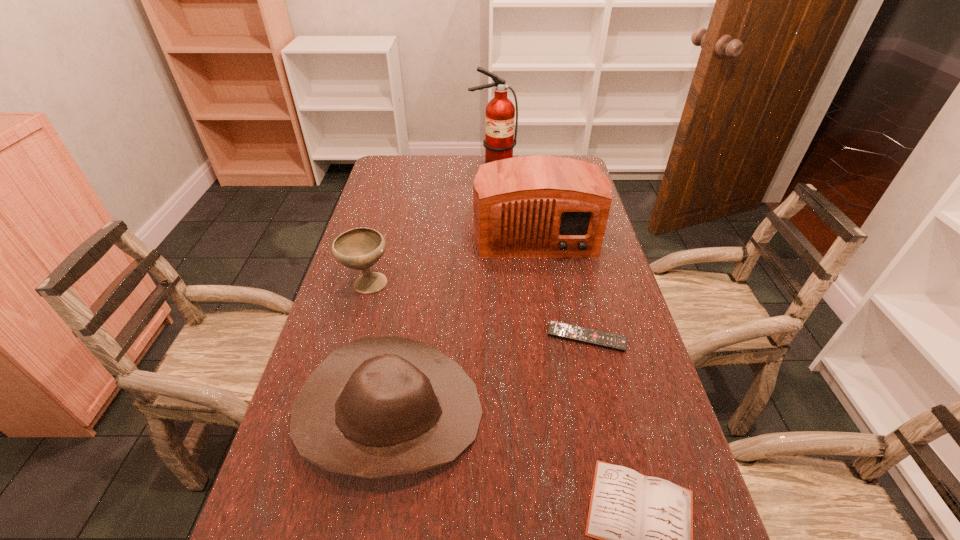
The width and height of the screenshot is (960, 540). I want to click on vacant space located 0.310m on the right of the cowboy hat, so (627, 413).

At what (x,y) coordinates should I click in order to perform the action: click on free spot located 0.060m on the front of the shortest object. Please return your answer as a coordinate pair (x, y). The image size is (960, 540). Looking at the image, I should click on (595, 374).

At what (x,y) coordinates should I click in order to perform the action: click on object that is positioned at the far edge. Please return your answer as a coordinate pair (x, y). The width and height of the screenshot is (960, 540). Looking at the image, I should click on (499, 141).

What are the coordinates of `chalice that is positioned at the left edge` in the screenshot? It's located at (360, 248).

At what (x,y) coordinates should I click in order to perform the action: click on cowboy hat that is at the left edge. Please return your answer as a coordinate pair (x, y). The width and height of the screenshot is (960, 540). Looking at the image, I should click on (379, 406).

Locate an element on the screen. radio receiver located at the right edge is located at coordinates (539, 206).

Where is `remote control at the right edge`? The width and height of the screenshot is (960, 540). remote control at the right edge is located at coordinates (617, 342).

You are a GUI agent. You are given a task and a screenshot of the screen. Output one action in this format:
    pyautogui.click(x=<x>, y=<y>)
    Task: Click on the blank space at the far edge of the desktop
    The height and width of the screenshot is (540, 960).
    Given the screenshot: What is the action you would take?
    coord(446,177)

Where is `free space at the left edge`? Image resolution: width=960 pixels, height=540 pixels. free space at the left edge is located at coordinates (304, 377).

Find the location of a particular element. The image size is (960, 540). vacant space at the right edge of the desktop is located at coordinates (590, 350).